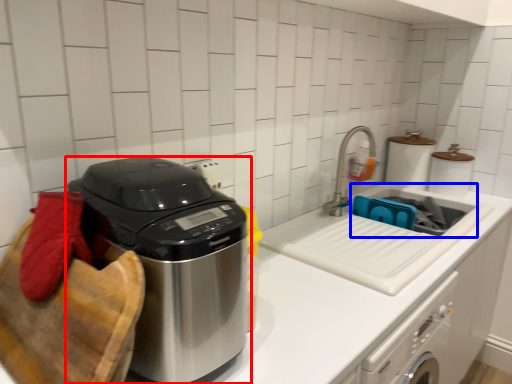
Question: Among these objects, which one is nearest to the camera, home appliance (highlighted by a red box) or sink (highlighted by a blue box)?

Choices:
 (A) home appliance
 (B) sink

Answer: (A)